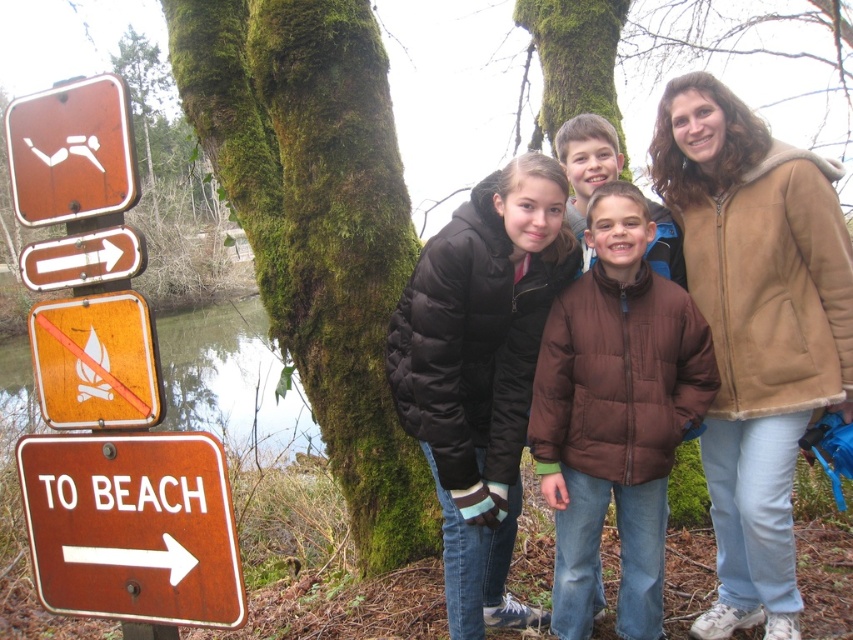
Question: From the image, what is the correct spatial relationship of brown quilted jacket at center in relation to orange wood fire sign at left?

Choices:
 (A) below
 (B) above

Answer: (A)

Question: Considering the real-world distances, which object is farthest from the brown sheepskin coat at center?

Choices:
 (A) orange wood fire sign at left
 (B) black puffy jacket at center
 (C) brown quilted jacket at center
 (D) green mossy tree at center

Answer: (A)

Question: From the image, what is the correct spatial relationship of brown sheepskin coat at center in relation to black puffy jacket at center?

Choices:
 (A) left
 (B) right

Answer: (B)

Question: Is brown quilted jacket at upper right positioned at the back of rusty metal sign at left?

Choices:
 (A) no
 (B) yes

Answer: (B)

Question: Which object is farther from the camera taking this photo?

Choices:
 (A) brown quilted jacket at center
 (B) brown sheepskin coat at center

Answer: (A)

Question: Among these points, which one is nearest to the camera?

Choices:
 (A) (332, 436)
 (B) (720, 340)
 (C) (445, 598)

Answer: (B)